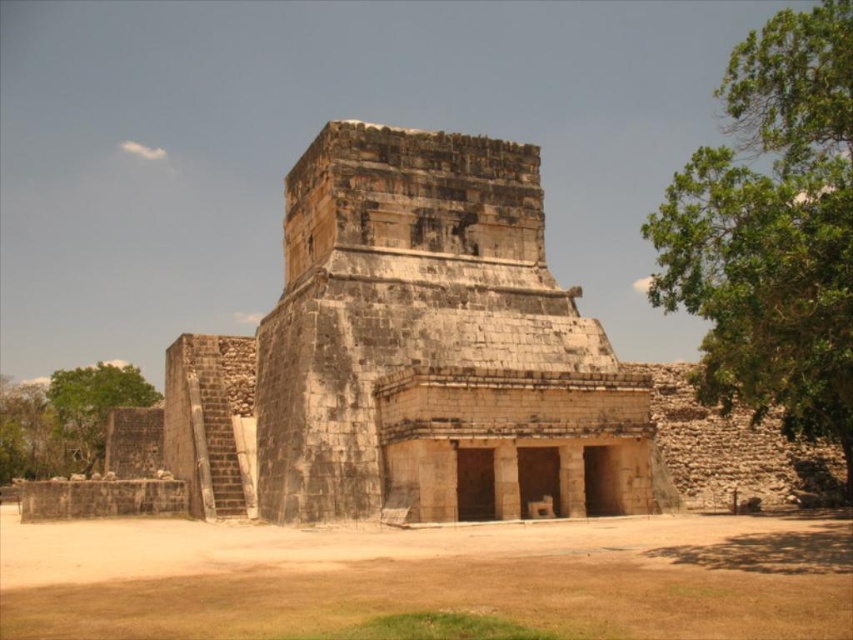
You are an archaeologist examining the ancient Mayan site. You notice the stone temple at center and the green leafy tree at lower left. Which object is taller?

The stone temple at center is taller than the green leafy tree at lower left according to the description.

You are standing in front of an ancient Mayan temple. You notice a specific point marked at coordinates point (469, 188). If you want to reach this point without moving your feet, which direction should you look?

You should look towards the point (469, 188), which is 231.10 feet away from you. Since you cannot move your feet, you need to adjust your gaze direction to face that point directly.